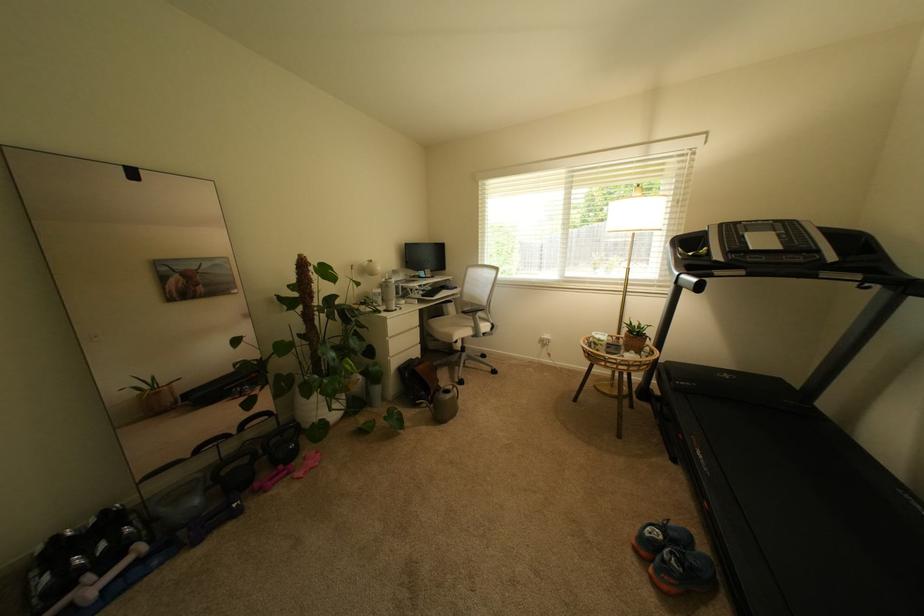
Where would you pull the white drawer handle? Please return your answer as a coordinate pair (x, y).

(403, 341)